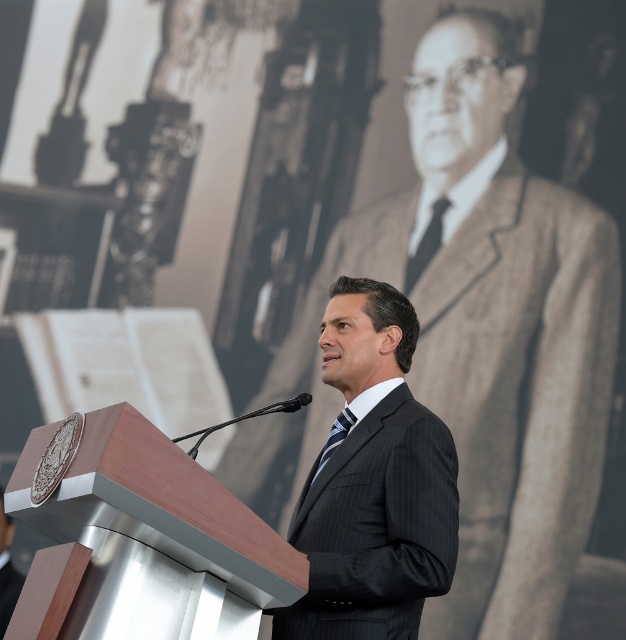
You are a photographer at the event and need to ensure both the black silk tie at center and the striped fabric tie at center are clearly visible in the photo. Given their sizes, which one might require more careful framing to avoid being overshadowed?

The striped fabric tie at center is smaller than the black silk tie at center, so it might require more careful framing to ensure it is clearly visible and not overshadowed by the larger tie.

You are an event organizer and need to position two markers on the stage. The first marker is at point (530, 550) and the second at point (205, 472). Which marker is closer to the audience if the audience is facing the stage from the front?

Point (205, 472) is closer to the audience because it is in front of point (530, 550), which is behind it.